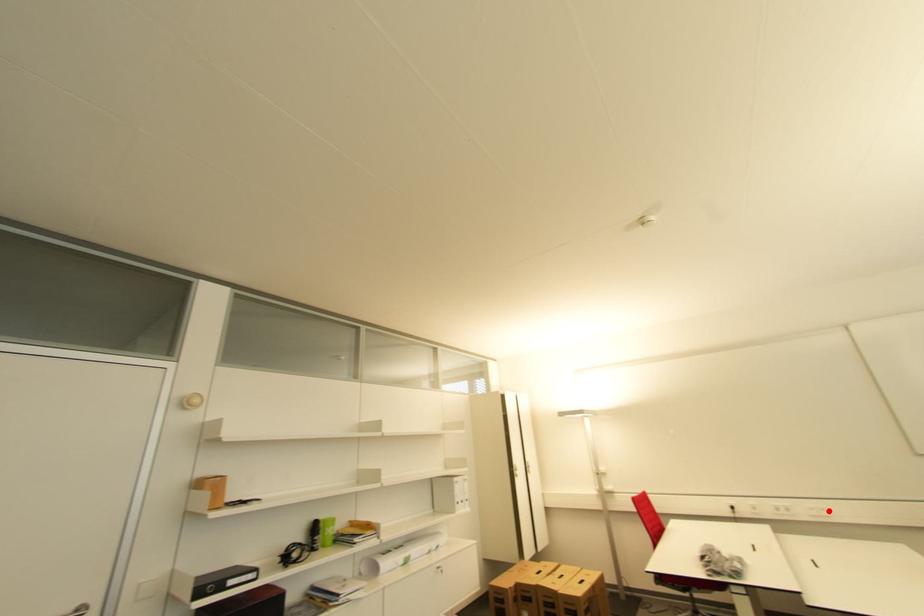
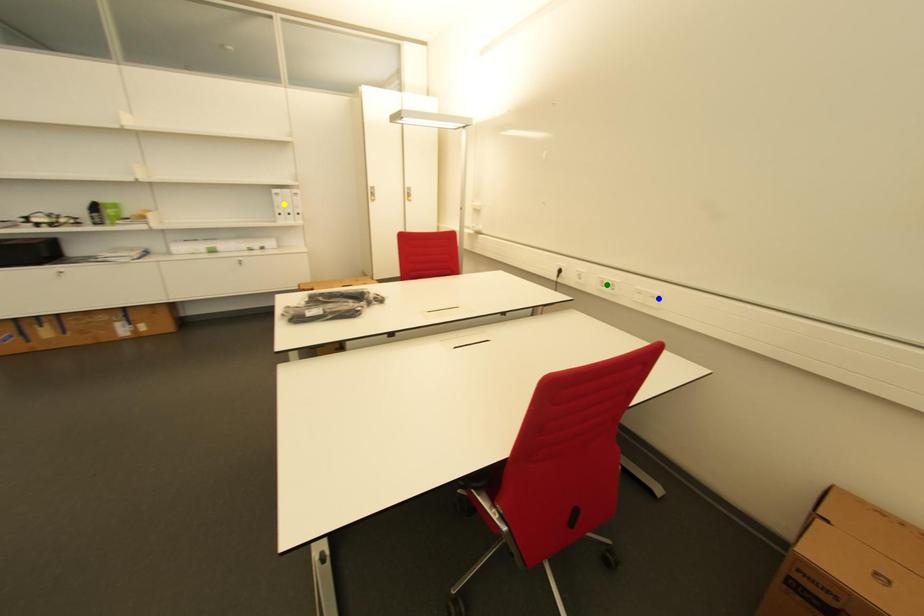
Question: I am providing you with two images of the same scene from different viewpoints. A red point is marked on the first image. You are given multiple points on the second image. Which point in image 2 represents the same 3d spot as the red point in image 1?

Choices:
 (A) green point
 (B) yellow point
 (C) blue point

Answer: (C)